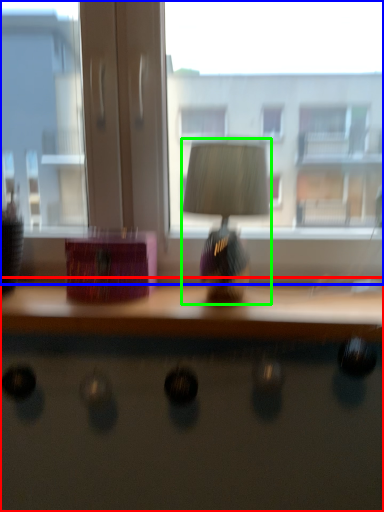
Question: Considering the real-world distances, which object is farthest from desk (highlighted by a red box)? window (highlighted by a blue box) or table lamp (highlighted by a green box)?

Choices:
 (A) window
 (B) table lamp

Answer: (A)